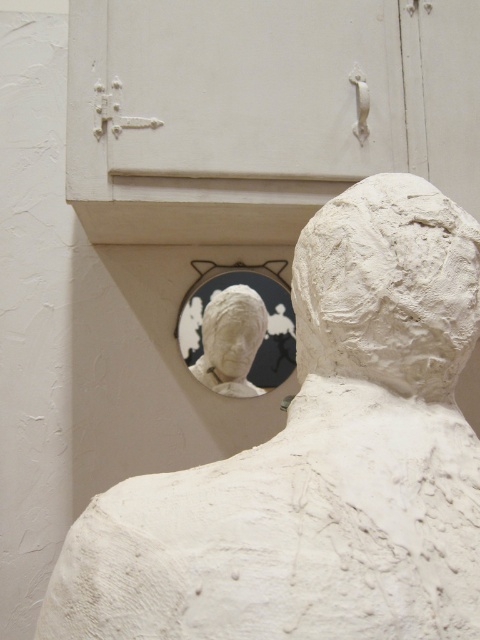
You are an art student who wants to place a decorative frame around both the white clay head at center and the white glossy mirror at center. Based on their sizes, which object requires a larger frame?

The white glossy mirror at center requires a larger frame because it has a greater width than the white clay head at center.

You are an art student who wants to hang a new painting between the white clay bust at upper center and the white glossy mirror at center. Can the painting fit vertically between them?

The white clay bust at upper center is taller than the white glossy mirror at center, so the vertical space between them may be sufficient for a painting, but the exact dimensions depend on the painting size and spacing between the objects.